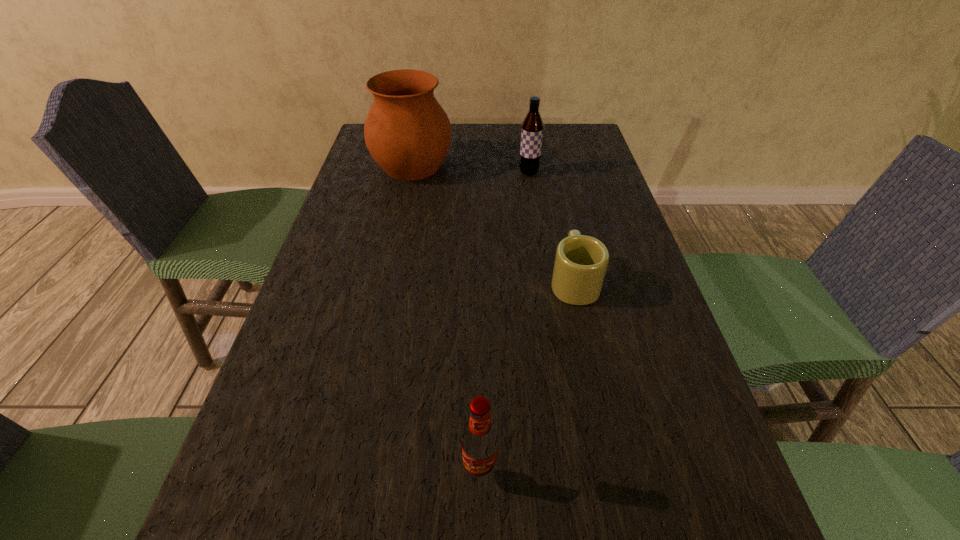
The height and width of the screenshot is (540, 960). What are the coordinates of `object that is the second closest one to the leftmost object` in the screenshot? It's located at (581, 261).

Find the location of `object that ranks as the second closest to the farther root beer`. object that ranks as the second closest to the farther root beer is located at coordinates (581, 261).